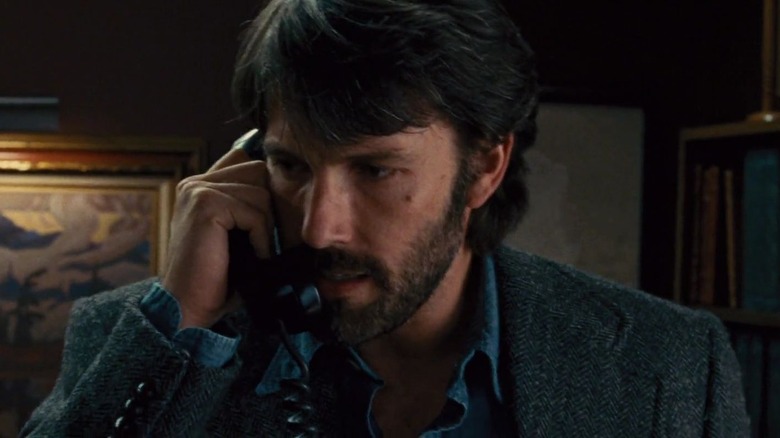
The width and height of the screenshot is (780, 438). Identify the location of black telephone. (261, 292).